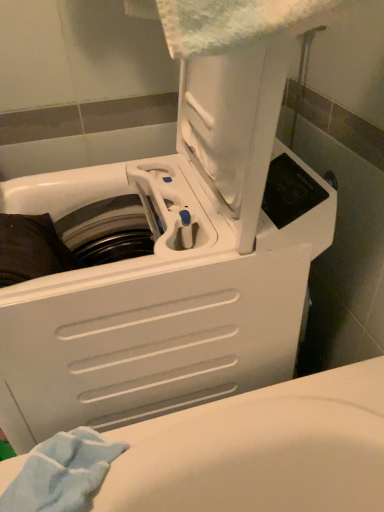
Question: Is white plastic washing machine at center to the right of light blue soft towel at lower left from the viewer's perspective?

Choices:
 (A) no
 (B) yes

Answer: (B)

Question: Considering the relative sizes of white plastic washing machine at center and light blue soft towel at lower left in the image provided, is white plastic washing machine at center shorter than light blue soft towel at lower left?

Choices:
 (A) no
 (B) yes

Answer: (A)

Question: Is white plastic washing machine at center to the left of light blue soft towel at lower left from the viewer's perspective?

Choices:
 (A) no
 (B) yes

Answer: (A)

Question: Is the position of white plastic washing machine at center more distant than that of light blue soft towel at lower left?

Choices:
 (A) no
 (B) yes

Answer: (A)

Question: Is white plastic washing machine at center not inside light blue soft towel at lower left?

Choices:
 (A) yes
 (B) no

Answer: (A)

Question: From a real-world perspective, is white plastic washing machine at center physically above light blue soft towel at lower left?

Choices:
 (A) yes
 (B) no

Answer: (A)

Question: Is light blue soft towel at lower left shorter than white plastic washing machine at center?

Choices:
 (A) yes
 (B) no

Answer: (A)

Question: Is white plastic washing machine at center surrounded by light blue soft towel at lower left?

Choices:
 (A) no
 (B) yes

Answer: (A)

Question: From a real-world perspective, does light blue soft towel at lower left stand above white plastic washing machine at center?

Choices:
 (A) no
 (B) yes

Answer: (A)

Question: Is the position of light blue soft towel at lower left more distant than that of white plastic washing machine at center?

Choices:
 (A) no
 (B) yes

Answer: (B)

Question: Is light blue soft towel at lower left thinner than white plastic washing machine at center?

Choices:
 (A) yes
 (B) no

Answer: (A)

Question: Does light blue soft towel at lower left appear on the left side of white plastic washing machine at center?

Choices:
 (A) yes
 (B) no

Answer: (A)

Question: From their relative heights in the image, would you say light blue soft towel at lower left is taller or shorter than white plastic washing machine at center?

Choices:
 (A) short
 (B) tall

Answer: (A)